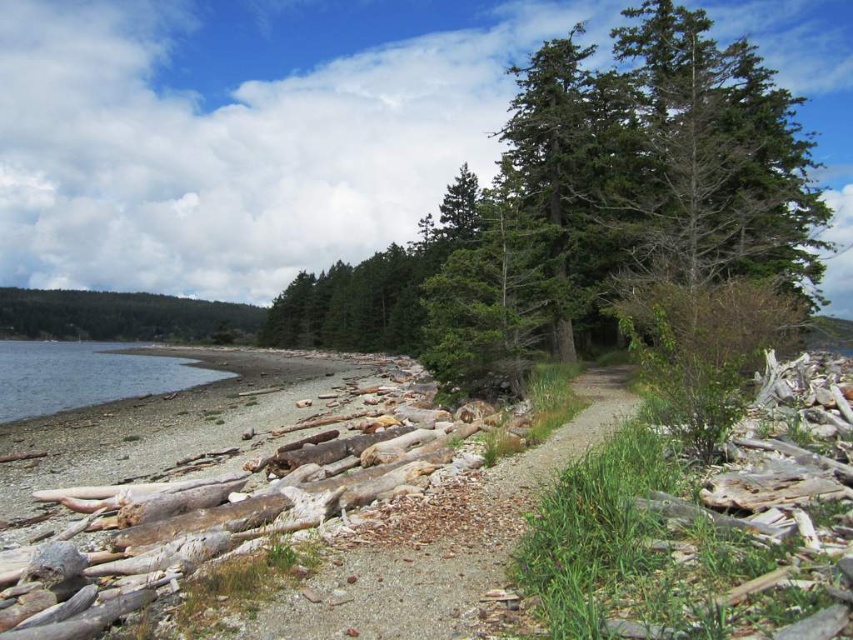
Can you confirm if green textured tree at upper center is taller than gravelly dirt path at center?

Yes.

Is point (457, 256) more distant than point (433, 502)?

Yes, it is behind point (433, 502).

Image resolution: width=853 pixels, height=640 pixels. What are the coordinates of `green textured tree at upper center` in the screenshot? It's located at (589, 208).

Which of these two, green textured tree at upper center or clear water at lower left, stands shorter?

Standing shorter between the two is clear water at lower left.

Is green textured tree at upper center taller than clear water at lower left?

Yes.

Is point (618, 240) positioned before point (169, 388)?

Yes.

Locate an element on the screen. green textured tree at upper center is located at coordinates (589, 208).

The image size is (853, 640). Identify the location of gravelly dirt path at center. (440, 541).

Who is lower down, gravelly dirt path at center or clear water at lower left?

clear water at lower left

Image resolution: width=853 pixels, height=640 pixels. Identify the location of gravelly dirt path at center. (440, 541).

Identify the location of gravelly dirt path at center. The height and width of the screenshot is (640, 853). (440, 541).